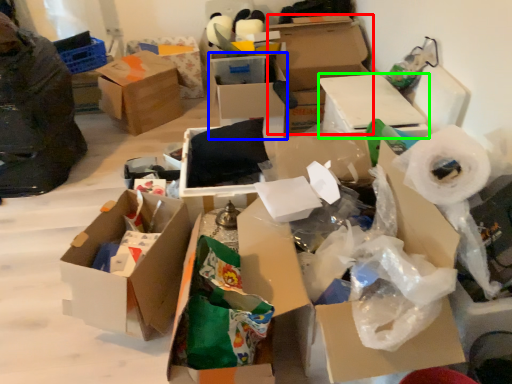
Question: Which object is positioned farthest from box (highlighted by a red box)? Select from box (highlighted by a blue box) and box (highlighted by a green box).

Choices:
 (A) box
 (B) box

Answer: (B)